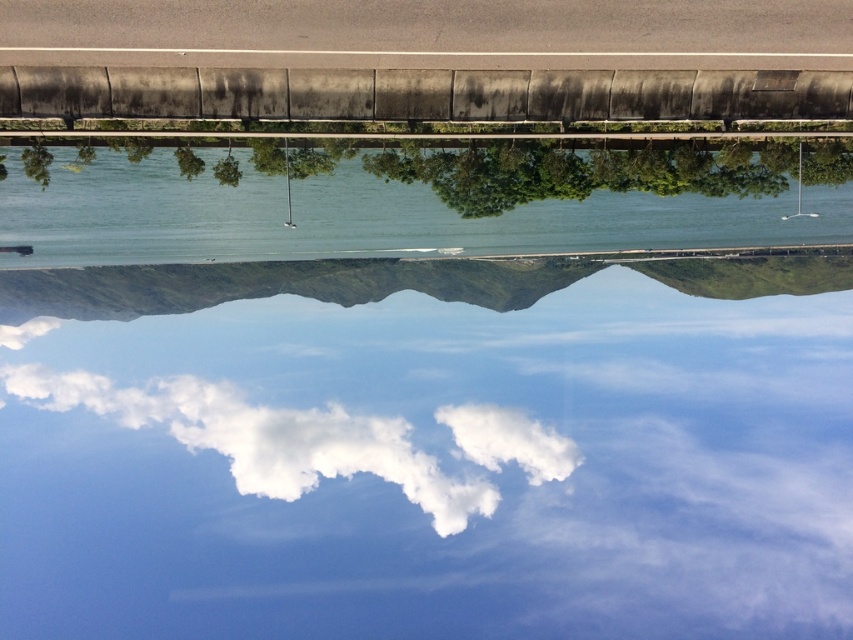
Who is higher up, clear water at center or white fluffy cloud at center?

Positioned higher is clear water at center.

Based on the photo, is clear water at center smaller than white fluffy cloud at center?

Yes.

At what (x,y) coordinates should I click in order to perform the action: click on clear water at center. Please return your answer as a coordinate pair (x, y). The width and height of the screenshot is (853, 640). Looking at the image, I should click on click(x=410, y=198).